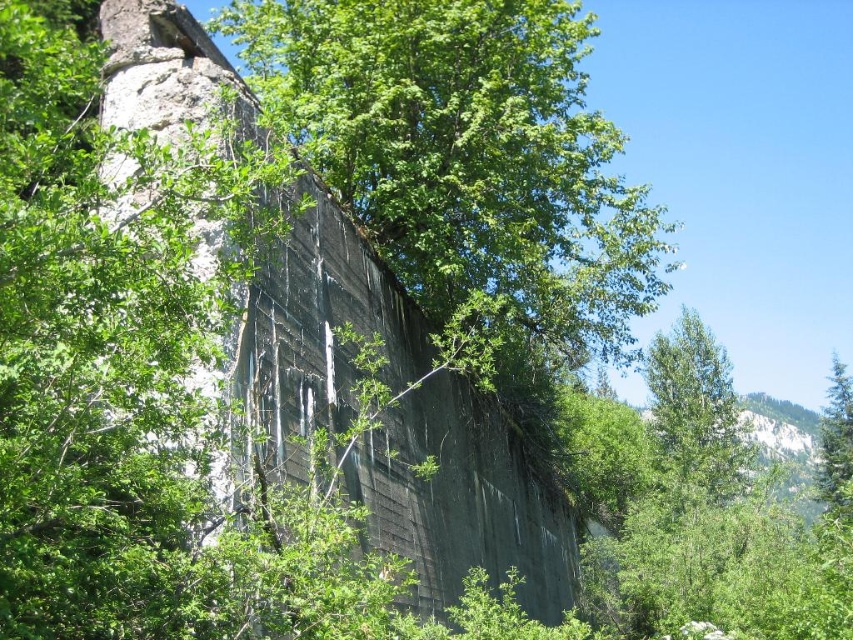
Question: Does green leafy tree at upper center have a larger size compared to green textured pine tree at right?

Choices:
 (A) yes
 (B) no

Answer: (B)

Question: Is rough concrete wall at center to the left of green textured pine tree at right from the viewer's perspective?

Choices:
 (A) yes
 (B) no

Answer: (A)

Question: Which object is farther from the camera taking this photo?

Choices:
 (A) green leafy tree at upper right
 (B) green textured pine tree at right

Answer: (B)

Question: Considering the real-world distances, which object is farthest from the green leafy tree at upper center?

Choices:
 (A) green textured pine tree at right
 (B) green leafy tree at upper right

Answer: (A)

Question: Among these objects, which one is nearest to the camera?

Choices:
 (A) green leafy tree at upper right
 (B) green leafy tree at upper center
 (C) green textured pine tree at right
 (D) rough concrete wall at center

Answer: (B)

Question: Can you confirm if rough concrete wall at center is bigger than green leafy tree at upper right?

Choices:
 (A) yes
 (B) no

Answer: (A)